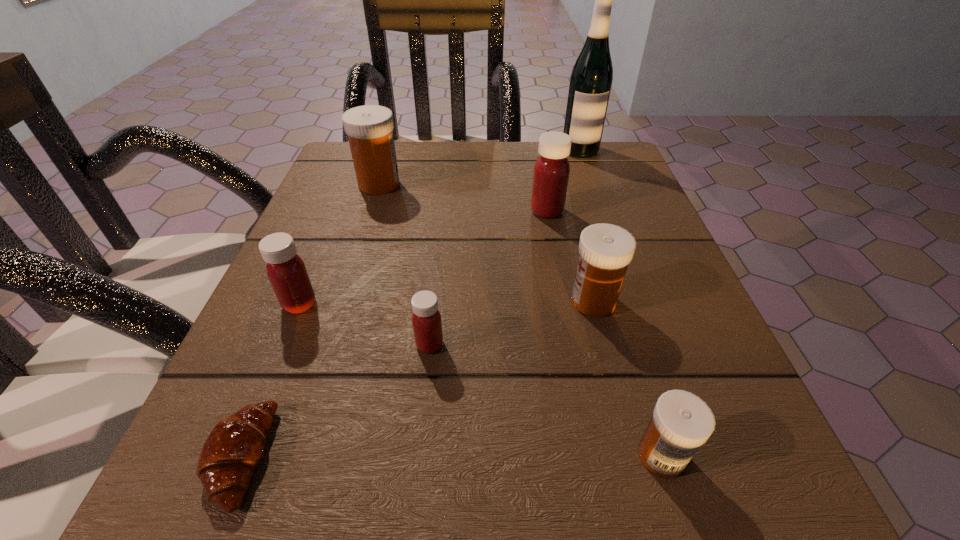
Locate an element on the screen. This screenshot has width=960, height=540. the third medicine from left to right is located at coordinates (427, 324).

In order to click on the nearest medicine in this screenshot , I will do `click(681, 422)`.

Where is `the nearest white medicine`? Image resolution: width=960 pixels, height=540 pixels. the nearest white medicine is located at coordinates (681, 422).

I want to click on brown crescent roll, so click(x=233, y=449).

The width and height of the screenshot is (960, 540). In order to click on the shortest object in this screenshot , I will do `click(233, 449)`.

The height and width of the screenshot is (540, 960). Find the location of `blank space located on the label of the tallest object`. blank space located on the label of the tallest object is located at coordinates (611, 238).

The width and height of the screenshot is (960, 540). Find the location of `vacant space positioned on the back of the leftmost white medicine`. vacant space positioned on the back of the leftmost white medicine is located at coordinates (389, 156).

Where is `vacant space located 0.240m on the front of the sixth nearest object`? The width and height of the screenshot is (960, 540). vacant space located 0.240m on the front of the sixth nearest object is located at coordinates (567, 315).

Identify the location of blank space located on the left of the second farthest white medicine. The image size is (960, 540). (426, 301).

You are a GUI agent. You are given a task and a screenshot of the screen. Output one action in this format:
    pyautogui.click(x=<x>, y=<y>)
    Task: Click on the free location located 0.160m on the back of the leftmost red medicine
    This screenshot has height=540, width=960.
    Given the screenshot: What is the action you would take?
    pyautogui.click(x=329, y=230)